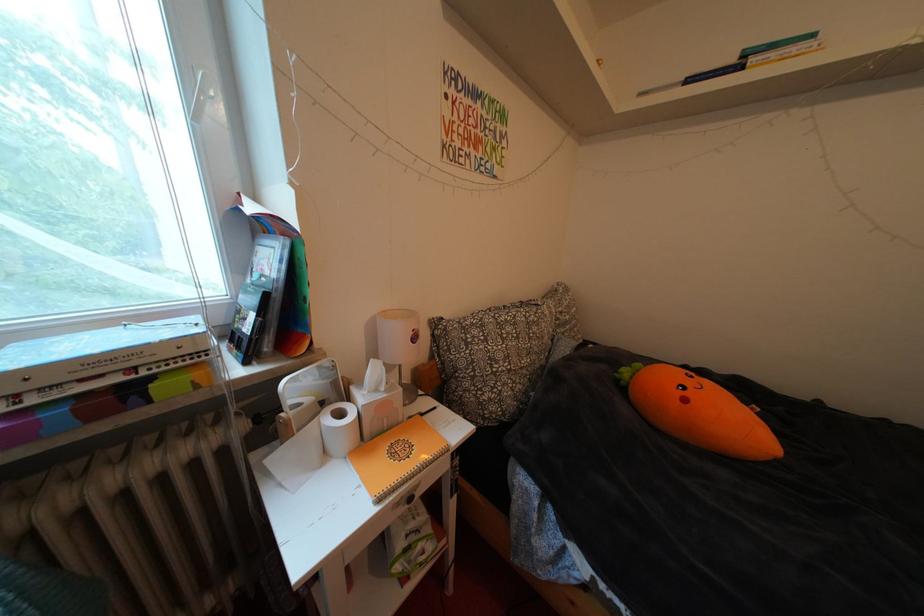
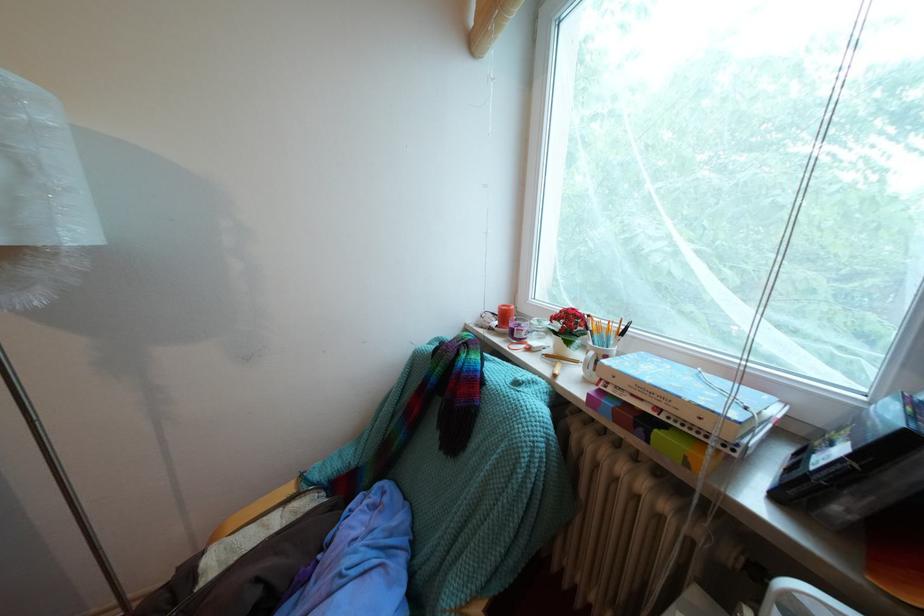
Where in the second image is the point corresponding to pixel 266 325 from the first image?

(853, 466)